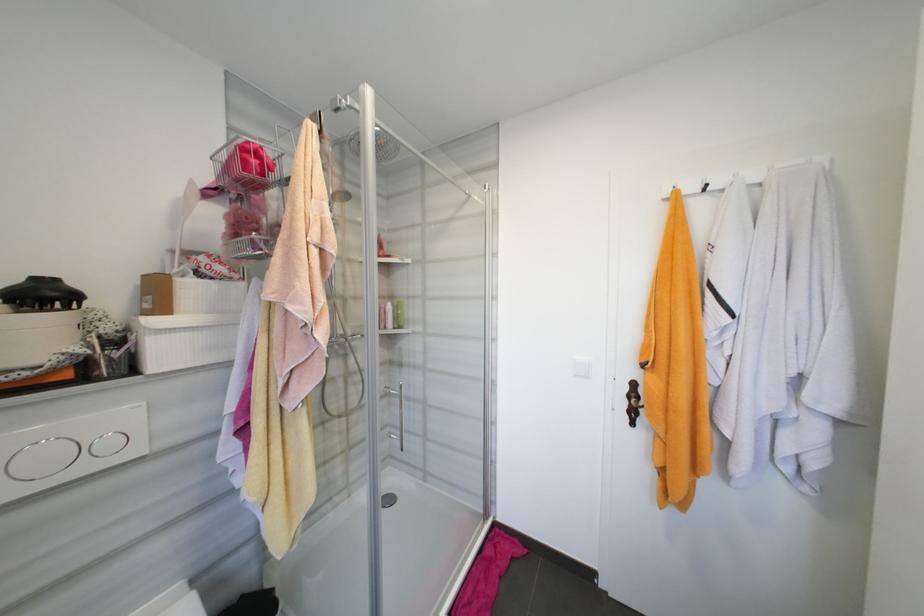
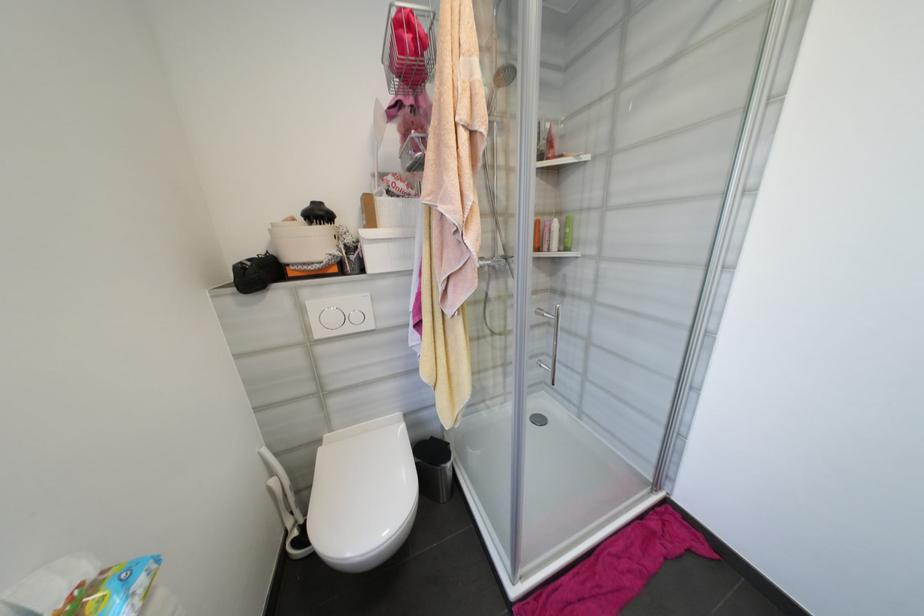
The point at (397,458) is marked in the first image. Where is the corresponding point in the second image?

(552, 384)